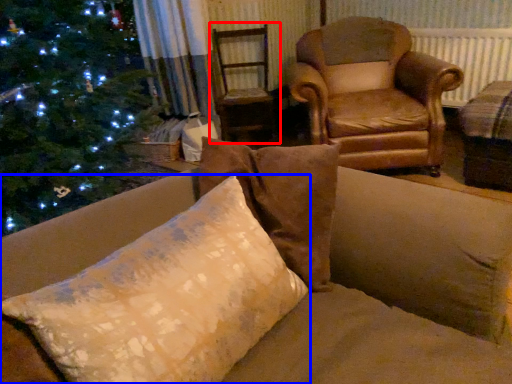
Question: Which of the following is the farthest to the observer, swivel chair (highlighted by a red box) or pillow (highlighted by a blue box)?

Choices:
 (A) swivel chair
 (B) pillow

Answer: (A)